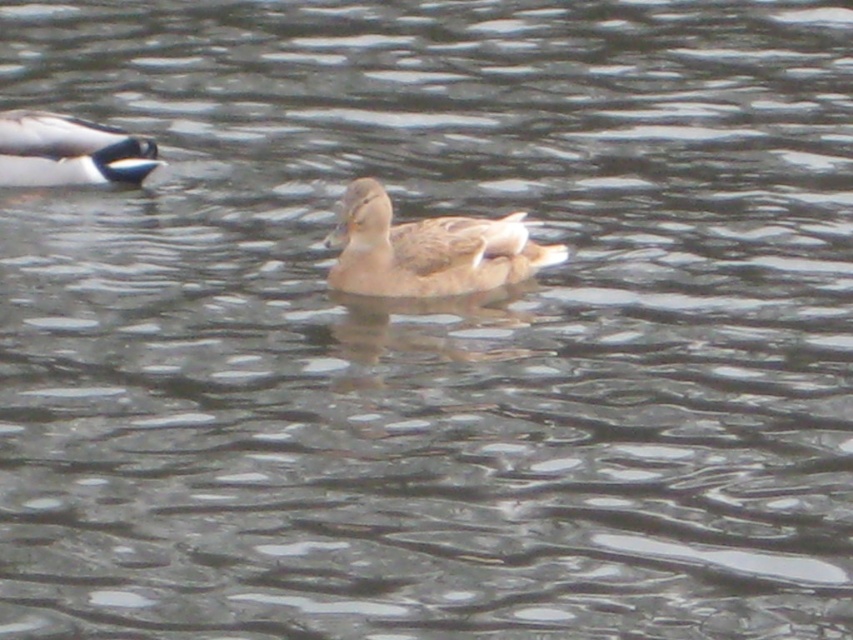
Question: Is brown matte duck at center to the right of white glossy duck at upper left from the viewer's perspective?

Choices:
 (A) yes
 (B) no

Answer: (A)

Question: Is brown matte duck at center to the left of white glossy duck at upper left from the viewer's perspective?

Choices:
 (A) no
 (B) yes

Answer: (A)

Question: Among these objects, which one is farthest from the camera?

Choices:
 (A) white glossy duck at upper left
 (B) brown matte duck at center

Answer: (A)

Question: Does brown matte duck at center appear under white glossy duck at upper left?

Choices:
 (A) yes
 (B) no

Answer: (A)

Question: Which point is closer to the camera taking this photo?

Choices:
 (A) 387,221
 (B) 123,144

Answer: (A)